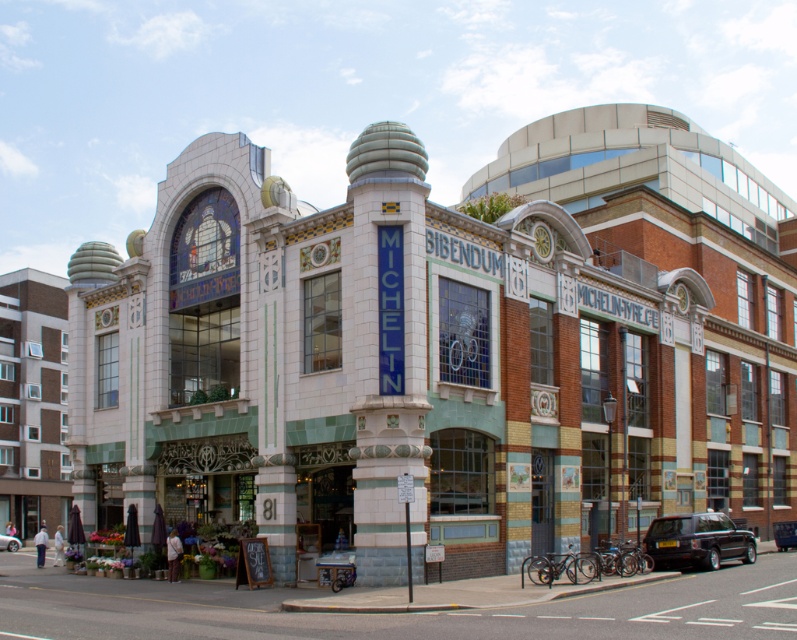
Does shiny black suv at lower right appear on the right side of metallic silver car at center?

Yes, shiny black suv at lower right is to the right of metallic silver car at center.

Between point (682, 531) and point (10, 547), which one is positioned behind?

The point (10, 547) is more distant.

You are a GUI agent. You are given a task and a screenshot of the screen. Output one action in this format:
    pyautogui.click(x=<x>, y=<y>)
    Task: Click on the shiny black suv at lower right
    The height and width of the screenshot is (640, 797).
    Given the screenshot: What is the action you would take?
    pyautogui.click(x=697, y=540)

Is point (595, 116) behind point (678, 548)?

That is True.

Locate an element on the screen. This screenshot has height=640, width=797. white tiled theater at center is located at coordinates (446, 349).

Between point (285, 320) and point (658, 531), which one is positioned behind?

Positioned behind is point (658, 531).

The width and height of the screenshot is (797, 640). In order to click on white tiled theater at center in this screenshot , I will do `click(446, 349)`.

Is point (678, 275) more distant than point (18, 547)?

No, it is not.

Who is lower down, white tiled theater at center or metallic silver car at center?

Positioned lower is metallic silver car at center.

Who is more forward, (143, 520) or (14, 529)?

Positioned in front is point (143, 520).

At what (x,y) coordinates should I click in order to perform the action: click on white tiled theater at center. Please return your answer as a coordinate pair (x, y). The width and height of the screenshot is (797, 640). Looking at the image, I should click on (446, 349).